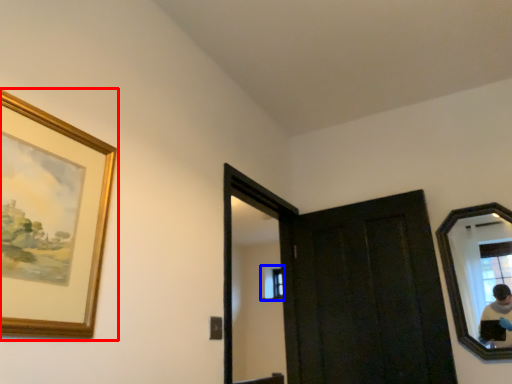
Question: Among these objects, which one is farthest to the camera, picture frame (highlighted by a red box) or window (highlighted by a blue box)?

Choices:
 (A) picture frame
 (B) window

Answer: (B)